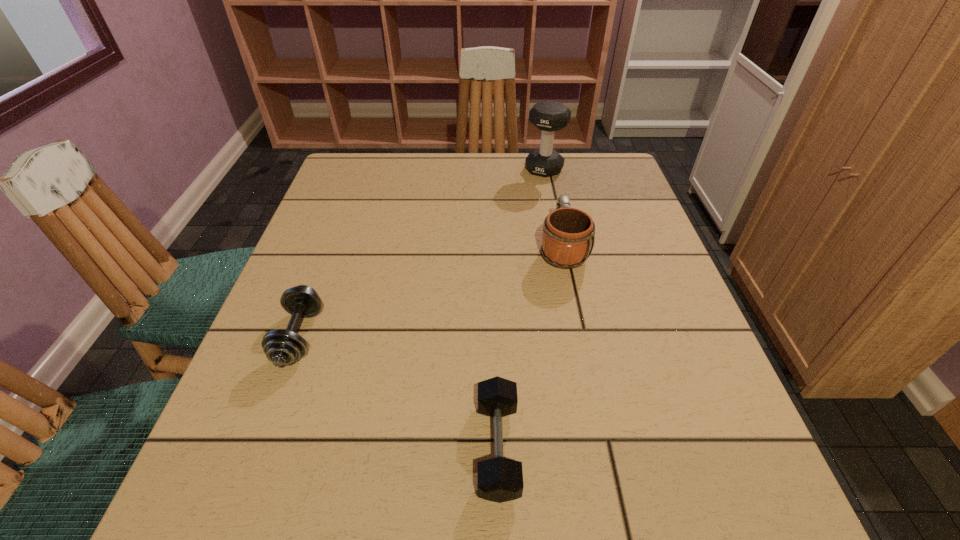
The height and width of the screenshot is (540, 960). I want to click on vacant space at the right edge of the desktop, so click(x=748, y=469).

Find the location of a particular element. Image resolution: width=960 pixels, height=540 pixels. vacant space at the far left corner of the desktop is located at coordinates (349, 189).

At what (x,y) coordinates should I click in order to perform the action: click on blank space at the far right corner. Please return your answer as a coordinate pair (x, y). The height and width of the screenshot is (540, 960). Looking at the image, I should click on (617, 194).

I want to click on vacant space that's between the second dumbbell from left to right and the leftmost dumbbell, so click(398, 392).

Where is `free spot between the nearest dumbbell and the mug`? The width and height of the screenshot is (960, 540). free spot between the nearest dumbbell and the mug is located at coordinates (530, 347).

In order to click on vacant space that is in between the third object from right to left and the third shortest object in this screenshot , I will do `click(530, 347)`.

The width and height of the screenshot is (960, 540). Find the location of `vacant point located between the tallest object and the second farthest dumbbell`. vacant point located between the tallest object and the second farthest dumbbell is located at coordinates (421, 253).

At what (x,y) coordinates should I click in order to perform the action: click on empty location between the farthest object and the leftmost dumbbell. Please return your answer as a coordinate pair (x, y). Image resolution: width=960 pixels, height=540 pixels. Looking at the image, I should click on (421, 253).

Where is `free space between the second farthest dumbbell and the nearest object`? Image resolution: width=960 pixels, height=540 pixels. free space between the second farthest dumbbell and the nearest object is located at coordinates (398, 392).

Where is `free point between the third shortest object and the second dumbbell from right to left`? Image resolution: width=960 pixels, height=540 pixels. free point between the third shortest object and the second dumbbell from right to left is located at coordinates (530, 347).